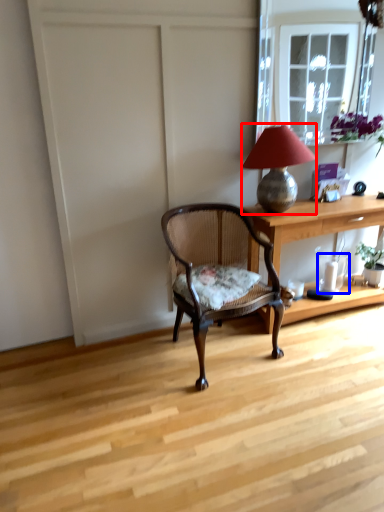
Question: Which of the following is the closest to the observer, lamp (highlighted by a red box) or glass vase (highlighted by a blue box)?

Choices:
 (A) lamp
 (B) glass vase

Answer: (A)